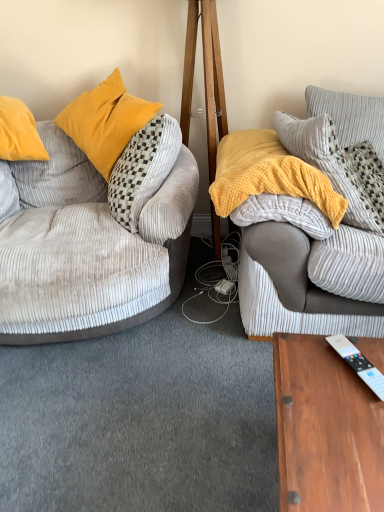
This screenshot has width=384, height=512. Describe the element at coordinates (272, 185) in the screenshot. I see `yellow textured blanket at center` at that location.

The height and width of the screenshot is (512, 384). Describe the element at coordinates (90, 245) in the screenshot. I see `velvet grey couch at left, which is the first studio couch from left to right` at that location.

This screenshot has width=384, height=512. Identify the location of yellow corduroy pillow at upper right, which is the 1th pillow in bottom-to-top order. (339, 167).

What is the approximate height of soft gray corduroy couch at right, marked as the 1th studio couch in a right-to-left arrangement?

soft gray corduroy couch at right, marked as the 1th studio couch in a right-to-left arrangement, is 73.83 centimeters in height.

Where is `yellow textured blanket at center`? This screenshot has height=512, width=384. yellow textured blanket at center is located at coordinates (272, 185).

Is yellow textured blanket at center aimed at yellow corduroy pillow at upper right, acting as the 2th pillow starting from the top?

No, yellow textured blanket at center is not facing towards yellow corduroy pillow at upper right, acting as the 2th pillow starting from the top.

From a real-world perspective, is yellow textured blanket at center positioned under yellow corduroy pillow at upper right, which is the 1th pillow in bottom-to-top order, based on gravity?

Incorrect, from a real-world perspective, yellow textured blanket at center is higher than yellow corduroy pillow at upper right, which is the 1th pillow in bottom-to-top order.

Considering the sizes of yellow textured blanket at center and yellow corduroy pillow at upper right, acting as the 2th pillow starting from the top, in the image, is yellow textured blanket at center bigger or smaller than yellow corduroy pillow at upper right, acting as the 2th pillow starting from the top,?

Considering their sizes, yellow textured blanket at center takes up more space than yellow corduroy pillow at upper right, acting as the 2th pillow starting from the top.

Is the surface of yellow textured blanket at center in direct contact with corduroy pillow at upper right, the second pillow from the bottom?

No, yellow textured blanket at center is not making contact with corduroy pillow at upper right, the second pillow from the bottom.

Is yellow textured blanket at center oriented towards corduroy pillow at upper right, the second pillow from the bottom?

No.

In terms of size, does yellow textured blanket at center appear bigger or smaller than corduroy pillow at upper right, the 1th pillow in the top-to-bottom sequence?

Considering their sizes, yellow textured blanket at center takes up more space than corduroy pillow at upper right, the 1th pillow in the top-to-bottom sequence.

Between yellow textured blanket at center and corduroy pillow at upper right, the second pillow from the bottom, which one is positioned in front?

yellow textured blanket at center is in front.

Which of these two, yellow textured blanket at center or soft gray corduroy couch at right, the second studio couch from the left, stands shorter?

With less height is yellow textured blanket at center.

Is yellow textured blanket at center further to camera compared to soft gray corduroy couch at right, marked as the 1th studio couch in a right-to-left arrangement?

Yes, it is behind soft gray corduroy couch at right, marked as the 1th studio couch in a right-to-left arrangement.

Where is `studio couch above the yellow textured blanket at center (from a real-world perspective)`? studio couch above the yellow textured blanket at center (from a real-world perspective) is located at coordinates (307, 271).

Consider the image. Which of these two, yellow textured blanket at center or soft gray corduroy couch at right, marked as the 1th studio couch in a right-to-left arrangement, is wider?

Wider between the two is yellow textured blanket at center.

Is yellow corduroy pillow at upper right, acting as the 2th pillow starting from the top, to the right of white plastic remote control at lower right from the viewer's perspective?

Yes, yellow corduroy pillow at upper right, acting as the 2th pillow starting from the top, is to the right of white plastic remote control at lower right.

Consider the image. Is yellow corduroy pillow at upper right, acting as the 2th pillow starting from the top, shorter than white plastic remote control at lower right?

Incorrect, the height of yellow corduroy pillow at upper right, acting as the 2th pillow starting from the top, does not fall short of that of white plastic remote control at lower right.

From the image's perspective, which object appears higher, yellow corduroy pillow at upper right, acting as the 2th pillow starting from the top, or white plastic remote control at lower right?

yellow corduroy pillow at upper right, acting as the 2th pillow starting from the top.

Looking at the image, does yellow corduroy pillow at upper right, acting as the 2th pillow starting from the top, seem bigger or smaller compared to white plastic remote control at lower right?

In the image, yellow corduroy pillow at upper right, acting as the 2th pillow starting from the top, appears to be larger than white plastic remote control at lower right.

Can you confirm if white plastic remote control at lower right is positioned to the right of soft gray corduroy couch at right, marked as the 1th studio couch in a right-to-left arrangement?

No, white plastic remote control at lower right is not to the right of soft gray corduroy couch at right, marked as the 1th studio couch in a right-to-left arrangement.

Can you tell me how much white plastic remote control at lower right and soft gray corduroy couch at right, the second studio couch from the left, differ in facing direction?

The angle between the facing direction of white plastic remote control at lower right and the facing direction of soft gray corduroy couch at right, the second studio couch from the left, is 170 degrees.

From the image's perspective, between white plastic remote control at lower right and soft gray corduroy couch at right, the second studio couch from the left, which one is located above?

From the image's view, soft gray corduroy couch at right, the second studio couch from the left, is above.

Does white plastic remote control at lower right come in front of soft gray corduroy couch at right, the second studio couch from the left?

Yes, white plastic remote control at lower right is in front of soft gray corduroy couch at right, the second studio couch from the left.

Can you confirm if white plastic remote control at lower right is thinner than velvet grey couch at left, which is the first studio couch from left to right?

Indeed, white plastic remote control at lower right has a lesser width compared to velvet grey couch at left, which is the first studio couch from left to right.

Is white plastic remote control at lower right not near velvet grey couch at left, which is the first studio couch from left to right?

Yes.

Is white plastic remote control at lower right facing towards velvet grey couch at left, the 2th studio couch in the right-to-left sequence?

Yes, white plastic remote control at lower right is turned towards velvet grey couch at left, the 2th studio couch in the right-to-left sequence.

From a real-world perspective, does white plastic remote control at lower right stand above velvet grey couch at left, which is the first studio couch from left to right?

Answer: No, from a real-world perspective, white plastic remote control at lower right is not above velvet grey couch at left, which is the first studio couch from left to right.

How many degrees apart are the facing directions of corduroy pillow at upper right, the second pillow from the bottom, and velvet grey couch at left, which is the first studio couch from left to right?

The angle between the facing direction of corduroy pillow at upper right, the second pillow from the bottom, and the facing direction of velvet grey couch at left, which is the first studio couch from left to right, is 15.9 degrees.

From a real-world perspective, count 2nd pillows upward from the velvet grey couch at left, which is the first studio couch from left to right, and point to it. Please provide its 2D coordinates.

[(350, 116)]

Is corduroy pillow at upper right, the second pillow from the bottom, next to velvet grey couch at left, which is the first studio couch from left to right, and touching it?

corduroy pillow at upper right, the second pillow from the bottom, and velvet grey couch at left, which is the first studio couch from left to right, are not in contact.

Is corduroy pillow at upper right, the second pillow from the bottom, situated inside velvet grey couch at left, which is the first studio couch from left to right, or outside?

corduroy pillow at upper right, the second pillow from the bottom, is outside velvet grey couch at left, which is the first studio couch from left to right.

At what (x,y) coordinates should I click in order to perform the action: click on pillow that is the 1st object located behind the yellow textured blanket at center. Please return your answer as a coordinate pair (x, y). Image resolution: width=384 pixels, height=512 pixels. Looking at the image, I should click on 339,167.

This screenshot has height=512, width=384. I want to click on pillow above the yellow textured blanket at center (from the image's perspective), so click(x=350, y=116).

Considering their positions, is yellow textured blanket at center positioned closer to white plastic remote control at lower right than velvet grey couch at left, which is the first studio couch from left to right?

The object closer to white plastic remote control at lower right is yellow textured blanket at center.

From the image, which object appears to be nearer to velvet grey couch at left, which is the first studio couch from left to right, white plastic remote control at lower right or soft gray corduroy couch at right, the second studio couch from the left?

Based on the image, soft gray corduroy couch at right, the second studio couch from the left, appears to be nearer to velvet grey couch at left, which is the first studio couch from left to right.

Looking at the image, which one is located further to yellow corduroy pillow at upper right, which is the 1th pillow in bottom-to-top order, corduroy pillow at upper right, the 1th pillow in the top-to-bottom sequence, or white plastic remote control at lower right?

white plastic remote control at lower right lies further to yellow corduroy pillow at upper right, which is the 1th pillow in bottom-to-top order, than the other object.

Based on their spatial positions, is yellow corduroy pillow at upper right, acting as the 2th pillow starting from the top, or white plastic remote control at lower right closer to soft gray corduroy couch at right, marked as the 1th studio couch in a right-to-left arrangement?

yellow corduroy pillow at upper right, acting as the 2th pillow starting from the top.

Estimate the real-world distances between objects in this image. Which object is closer to soft gray corduroy couch at right, the second studio couch from the left, corduroy pillow at upper right, the second pillow from the bottom, or white plastic remote control at lower right?

The object closer to soft gray corduroy couch at right, the second studio couch from the left, is corduroy pillow at upper right, the second pillow from the bottom.

Which object lies further to the anchor point corduroy pillow at upper right, the 1th pillow in the top-to-bottom sequence, yellow corduroy pillow at upper right, which is the 1th pillow in bottom-to-top order, or soft gray corduroy couch at right, marked as the 1th studio couch in a right-to-left arrangement?

The object further to corduroy pillow at upper right, the 1th pillow in the top-to-bottom sequence, is soft gray corduroy couch at right, marked as the 1th studio couch in a right-to-left arrangement.

Based on the photo, based on their spatial positions, is white plastic remote control at lower right or corduroy pillow at upper right, the second pillow from the bottom, further from yellow textured blanket at center?

white plastic remote control at lower right is further to yellow textured blanket at center.

When comparing their distances from soft gray corduroy couch at right, the second studio couch from the left, does yellow corduroy pillow at upper right, acting as the 2th pillow starting from the top, or yellow textured blanket at center seem closer?

yellow textured blanket at center is positioned closer to the anchor soft gray corduroy couch at right, the second studio couch from the left.

This screenshot has width=384, height=512. I want to click on material between white plastic remote control at lower right and corduroy pillow at upper right, the 1th pillow in the top-to-bottom sequence, in the front-back direction, so click(x=272, y=185).

Identify the location of pillow located between yellow textured blanket at center and corduroy pillow at upper right, the 1th pillow in the top-to-bottom sequence, in the depth direction. (339, 167).

The height and width of the screenshot is (512, 384). I want to click on remote control located between velvet grey couch at left, which is the first studio couch from left to right, and corduroy pillow at upper right, the 1th pillow in the top-to-bottom sequence, in the left-right direction, so click(x=358, y=362).

Identify the location of material between velvet grey couch at left, which is the first studio couch from left to right, and yellow corduroy pillow at upper right, acting as the 2th pillow starting from the top. (272, 185).